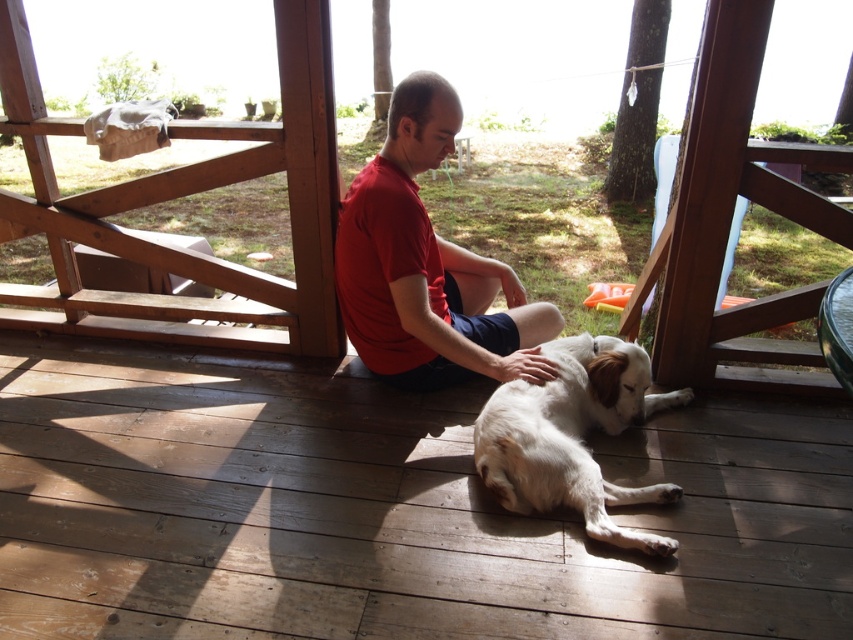
You are a photographer standing behind the deck. You want to take a photo of the matte red shirt at center and the white fur dog at center without any obstructions. Which subject should you focus on first to ensure both are in frame?

The white fur dog at center is behind the matte red shirt at center, so you should focus on the matte red shirt at center first to ensure both are in frame.

You are standing on the wooden deck at center and want to reach the white fur dog at center. In which direction should you move to get closer to the dog?

The wooden deck at center is to the left of white fur dog at center, so you should move to the right to get closer to the dog.

You are standing at the point with coordinates (x=386, y=509). Based on the scene description, what object are you standing on?

The point at (x=386, y=509) is indicating the wooden deck at center, so you are standing on the wooden deck at center.